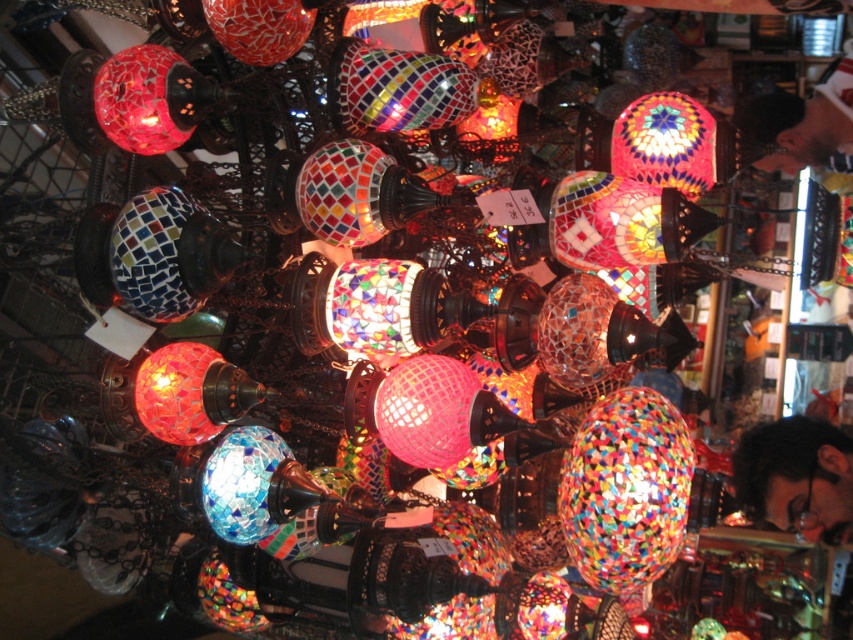
Which is above, dark hair at lower right or pink mosaic ball at center?

Positioned higher is pink mosaic ball at center.

How far apart are dark hair at lower right and pink mosaic ball at center?

dark hair at lower right and pink mosaic ball at center are 3.41 feet apart.

Which is behind, point (811, 458) or point (407, 420)?

Positioned behind is point (811, 458).

The height and width of the screenshot is (640, 853). Identify the location of dark hair at lower right. (796, 476).

What do you see at coordinates (796, 476) in the screenshot? I see `dark hair at lower right` at bounding box center [796, 476].

Does dark hair at lower right have a greater height compared to mosaic glass lamp at upper left?

Correct, dark hair at lower right is much taller as mosaic glass lamp at upper left.

Locate an element on the screen. dark hair at lower right is located at coordinates point(796,476).

Who is lower down, pink mosaic ball at center or mosaic glass lampshade at upper right?

pink mosaic ball at center is lower down.

Does pink mosaic ball at center have a smaller size compared to mosaic glass lampshade at upper right?

Yes, pink mosaic ball at center is smaller than mosaic glass lampshade at upper right.

What are the coordinates of `pink mosaic ball at center` in the screenshot? It's located at (426, 410).

What are the coordinates of `pink mosaic ball at center` in the screenshot? It's located at (426, 410).